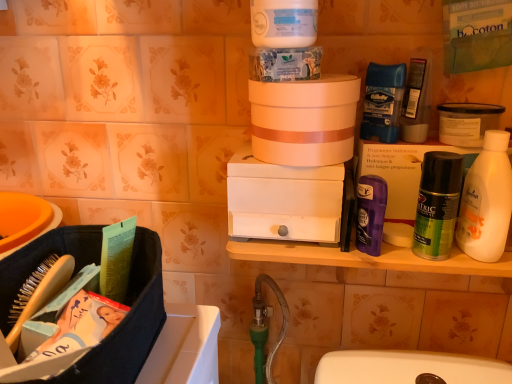
Question: From the image's perspective, does blue paper towel at upper center, arranged as the 2th product when ordered from the bottom, appear lower than white matte drawer at center, the second box positioned from the right?

Choices:
 (A) yes
 (B) no

Answer: (B)

Question: Is blue paper towel at upper center, acting as the first product starting from the left, at the left side of white matte drawer at center, which is the 1th box from left to right?

Choices:
 (A) no
 (B) yes

Answer: (B)

Question: Is blue paper towel at upper center, the first product from the top, placed right next to white matte drawer at center, which is the 1th box from left to right?

Choices:
 (A) yes
 (B) no

Answer: (B)

Question: Does blue paper towel at upper center, the first product from the top, have a larger size compared to white matte drawer at center, which is the 1th box from left to right?

Choices:
 (A) yes
 (B) no

Answer: (B)

Question: Is blue paper towel at upper center, the second product viewed from the right, closer to the viewer compared to white matte drawer at center, the second box positioned from the right?

Choices:
 (A) yes
 (B) no

Answer: (A)

Question: Looking at their shapes, would you say white matte jar at upper right, the second product when ordered from top to bottom, is wider or thinner than purple matte deodorant at right, marked as the second toiletry in a back-to-front arrangement?

Choices:
 (A) thin
 (B) wide

Answer: (B)

Question: From the image's perspective, relative to purple matte deodorant at right, marked as the second toiletry in a back-to-front arrangement, is white matte jar at upper right, which is the 1th product in bottom-to-top order, above or below?

Choices:
 (A) above
 (B) below

Answer: (A)

Question: Is point (446, 112) positioned closer to the camera than point (357, 213)?

Choices:
 (A) closer
 (B) farther

Answer: (B)

Question: Is white matte jar at upper right, the second product when ordered from top to bottom, situated inside purple matte deodorant at right, the second toiletry viewed from the top, or outside?

Choices:
 (A) outside
 (B) inside

Answer: (A)

Question: Is white matte drawer at center, which is the 1th box from left to right, situated inside matte white box at right, the 1th box viewed from the right, or outside?

Choices:
 (A) inside
 (B) outside

Answer: (B)

Question: Relative to matte white box at right, which is the 2th box from left to right, is white matte drawer at center, which is the 1th box from left to right, in front or behind?

Choices:
 (A) front
 (B) behind

Answer: (A)

Question: Is white matte drawer at center, the second box positioned from the right, wider or thinner than matte white box at right, the 1th box viewed from the right?

Choices:
 (A) thin
 (B) wide

Answer: (B)

Question: Based on their positions, is white matte drawer at center, the second box positioned from the right, located to the left or right of matte white box at right, the 1th box viewed from the right?

Choices:
 (A) right
 (B) left

Answer: (B)

Question: Is matte white box at right, which is the 2th box from left to right, inside the boundaries of purple matte deodorant at right, the first toiletry from the bottom, or outside?

Choices:
 (A) inside
 (B) outside

Answer: (B)

Question: Based on their sizes in the image, would you say matte white box at right, which is the 2th box from left to right, is bigger or smaller than purple matte deodorant at right, marked as the second toiletry in a back-to-front arrangement?

Choices:
 (A) big
 (B) small

Answer: (A)